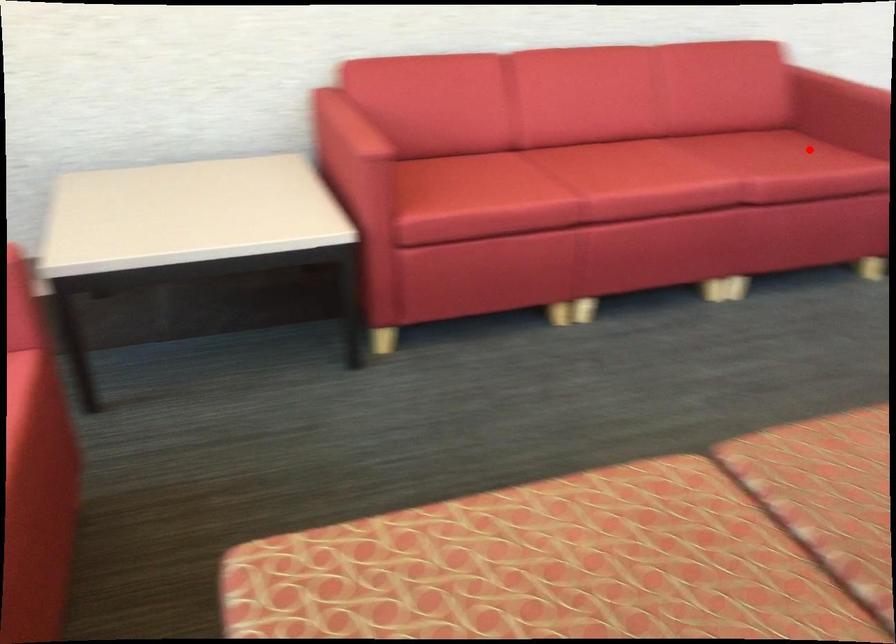
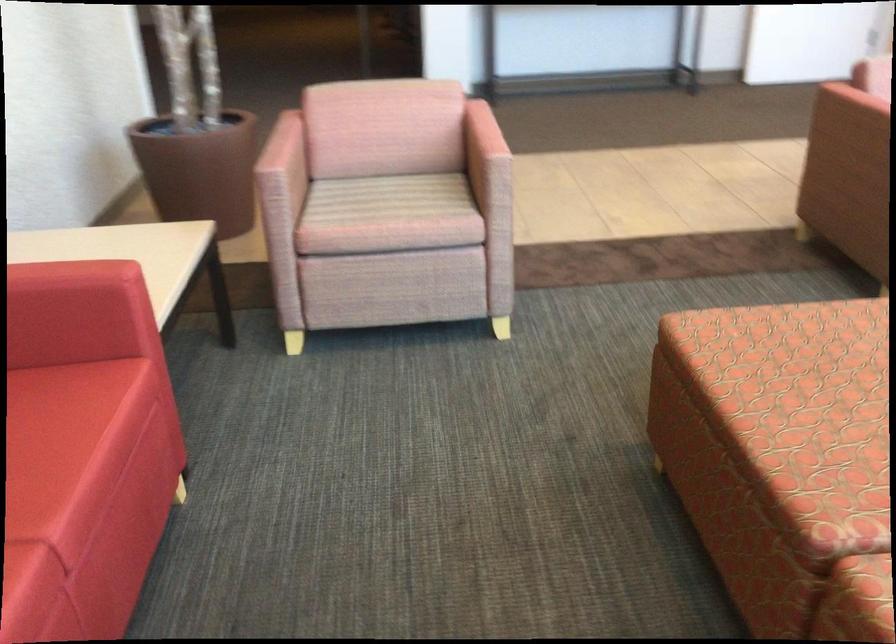
Find the pixel in the second image that matches the highlighted location in the first image.

(38, 408)